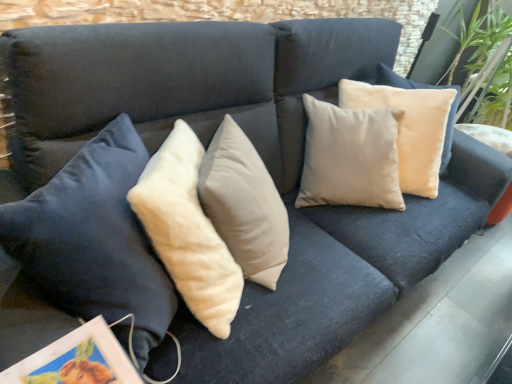
Question: Is green velvety plant at upper right at the left side of matte white picture frame at lower left?

Choices:
 (A) no
 (B) yes

Answer: (A)

Question: Could matte white picture frame at lower left be considered to be inside green velvety plant at upper right?

Choices:
 (A) yes
 (B) no

Answer: (B)

Question: Is green velvety plant at upper right in front of matte white picture frame at lower left?

Choices:
 (A) no
 (B) yes

Answer: (A)

Question: Can you confirm if green velvety plant at upper right is wider than matte white picture frame at lower left?

Choices:
 (A) yes
 (B) no

Answer: (A)

Question: From the image's perspective, is green velvety plant at upper right located beneath matte white picture frame at lower left?

Choices:
 (A) yes
 (B) no

Answer: (B)

Question: Does green velvety plant at upper right have a lesser width compared to matte white picture frame at lower left?

Choices:
 (A) yes
 (B) no

Answer: (B)

Question: Are matte white picture frame at lower left and green velvety plant at upper right making contact?

Choices:
 (A) yes
 (B) no

Answer: (B)

Question: Considering the relative sizes of matte white picture frame at lower left and green velvety plant at upper right in the image provided, is matte white picture frame at lower left wider than green velvety plant at upper right?

Choices:
 (A) no
 (B) yes

Answer: (A)

Question: From the image's perspective, does matte white picture frame at lower left appear lower than green velvety plant at upper right?

Choices:
 (A) yes
 (B) no

Answer: (A)

Question: Is there a large distance between matte white picture frame at lower left and green velvety plant at upper right?

Choices:
 (A) no
 (B) yes

Answer: (B)

Question: Is matte white picture frame at lower left looking in the opposite direction of green velvety plant at upper right?

Choices:
 (A) yes
 (B) no

Answer: (B)

Question: From the image's perspective, is matte white picture frame at lower left located above green velvety plant at upper right?

Choices:
 (A) no
 (B) yes

Answer: (A)

Question: Is green velvety plant at upper right wider or thinner than matte white picture frame at lower left?

Choices:
 (A) wide
 (B) thin

Answer: (A)